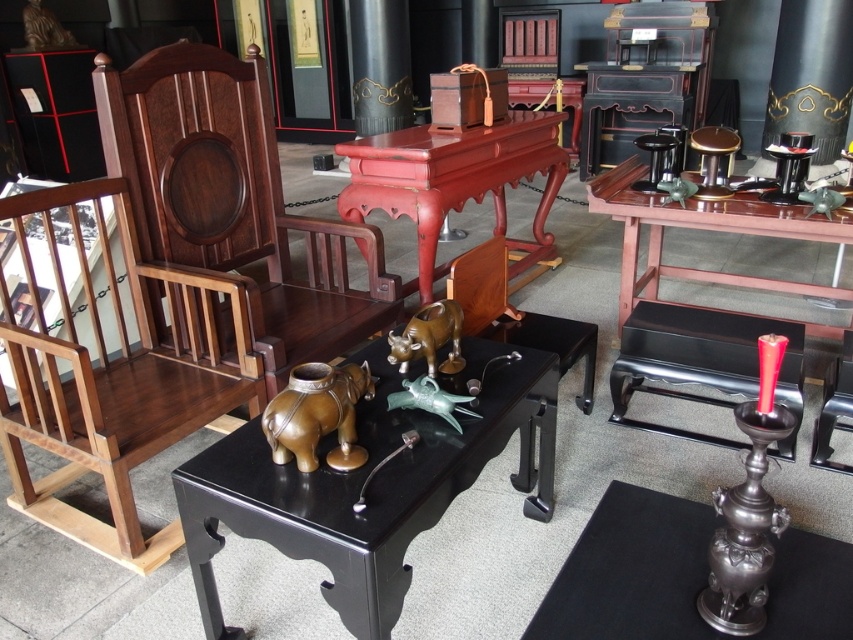
Question: Which point is closer to the camera?

Choices:
 (A) (329, 464)
 (B) (479, 163)
 (C) (123, 461)
 (D) (646, 136)

Answer: (A)

Question: Is polished wood chair at left to the right of polished wood chair at center from the viewer's perspective?

Choices:
 (A) yes
 (B) no

Answer: (B)

Question: Which point appears closest to the camera in this image?

Choices:
 (A) (410, 348)
 (B) (722, 188)
 (C) (19, 460)

Answer: (A)

Question: Which of the following is the farthest from the observer?

Choices:
 (A) metallic black stool at center-right
 (B) shiny bronze bull at center
 (C) metallic gold stool at upper right
 (D) bronze/brass-like elephant at center

Answer: (A)

Question: Can you confirm if polished wood chair at center is smaller than bronze/brass-like elephant at center?

Choices:
 (A) no
 (B) yes

Answer: (A)

Question: Is polished wood chair at center positioned in front of metallic gold stool at upper right?

Choices:
 (A) yes
 (B) no

Answer: (A)